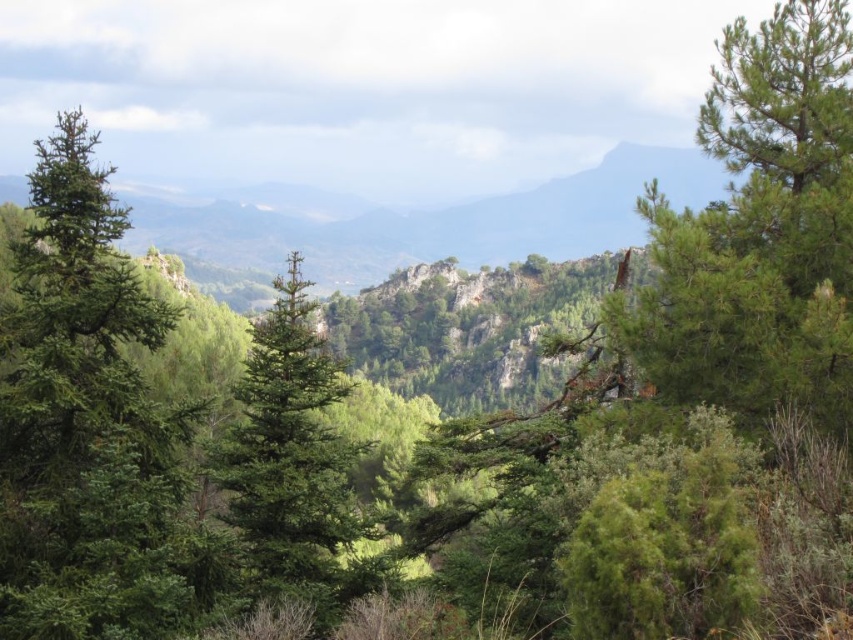
Can you confirm if green matte tree at left is positioned below green matte tree at center?

Actually, green matte tree at left is above green matte tree at center.

Looking at this image, measure the distance between green matte tree at left and camera.

green matte tree at left and camera are 17.18 meters apart from each other.

Locate an element on the screen. The height and width of the screenshot is (640, 853). green matte tree at left is located at coordinates [x=84, y=420].

Does green needle-like at center have a smaller size compared to green matte tree at left?

Incorrect, green needle-like at center is not smaller in size than green matte tree at left.

Is green needle-like at center wider than green matte tree at left?

No.

Who is more distant from viewer, (796, 250) or (67, 257)?

Positioned behind is point (796, 250).

This screenshot has height=640, width=853. Identify the location of green needle-like at center. (688, 392).

Which is in front, point (824, 365) or point (247, 417)?

Positioned in front is point (824, 365).

Is green needle-like at center smaller than green matte tree at center?

No, green needle-like at center is not smaller than green matte tree at center.

Is point (821, 518) more distant than point (258, 348)?

No, (821, 518) is closer to viewer.

The height and width of the screenshot is (640, 853). Identify the location of green needle-like at center. click(688, 392).